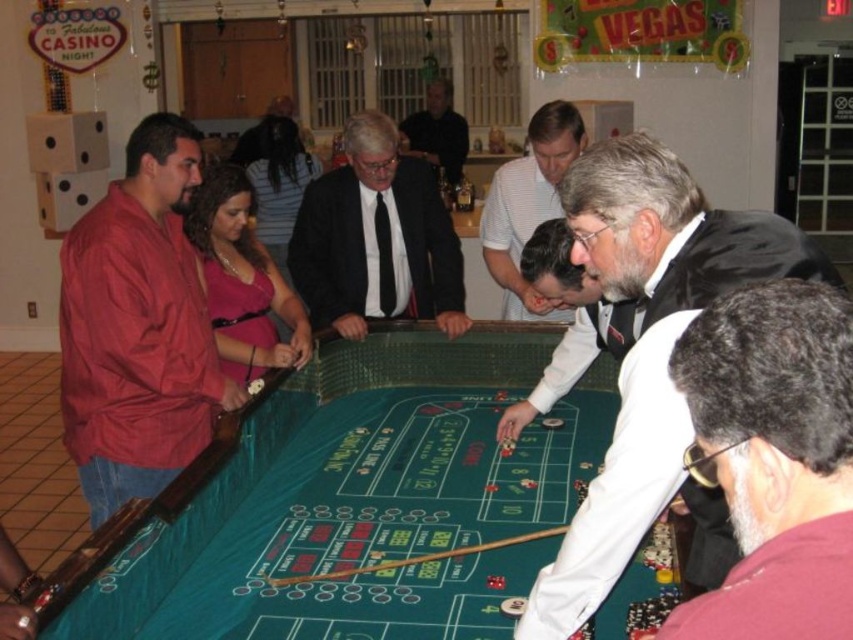
Is point (357, 273) more distant than point (422, 144)?

That is False.

Is black silk suit at center below dark gray suit at center?

Yes.

Is point (402, 289) farther from camera compared to point (431, 93)?

No, (402, 289) is in front of (431, 93).

Locate an element on the screen. The image size is (853, 640). black silk suit at center is located at coordinates (376, 237).

Between point (682, 486) and point (196, 428), which one is positioned behind?

The point (196, 428) is more distant.

Does white satin bow tie at center have a lesser height compared to matte red jacket at left?

Yes, white satin bow tie at center is shorter than matte red jacket at left.

Find the location of `white satin bow tie at center`. white satin bow tie at center is located at coordinates (653, 358).

You are a GUI agent. You are given a task and a screenshot of the screen. Output one action in this format:
    pyautogui.click(x=<x>, y=<y>)
    Task: Click on the white satin bow tie at center
    
    Given the screenshot: What is the action you would take?
    pyautogui.click(x=653, y=358)

Is gray hair at lower right closer to camera compared to dark gray suit at center?

Yes, it is.

Does point (788, 301) come behind point (399, 125)?

No, it is in front of (399, 125).

Where is `gray hair at lower right`? Image resolution: width=853 pixels, height=640 pixels. gray hair at lower right is located at coordinates (773, 458).